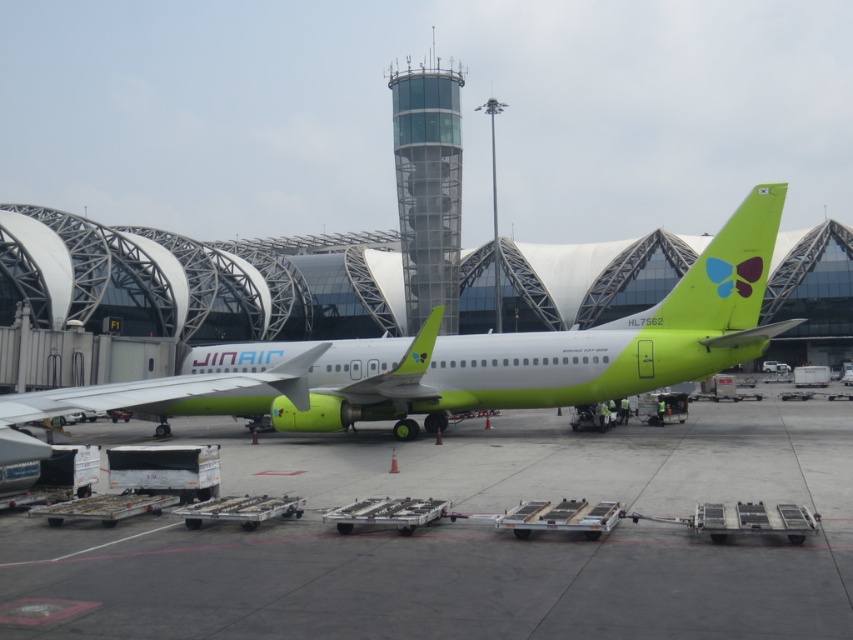
You are standing at the jet bridge leading to the airplane. You want to walk to the green matte tarmac at center marked by point (471, 540). Which direction should you go from the jet bridge?

The green matte tarmac at center marked by point (471, 540) is located at the center of the scene. To reach it from the jet bridge, you should walk away from the airplane towards the center of the image.

You are an airport maintenance worker who needs to determine if the green matte tarmac at center can support the weight of the matte green airplane at center. Based on the scene, what should you consider?

The green matte tarmac at center is not as tall as matte green airplane at center, which suggests that the tarmac is lower in elevation but does not indicate its load capacity. You should consult the tarmac specifications for weight limits rather than relying on height comparisons.